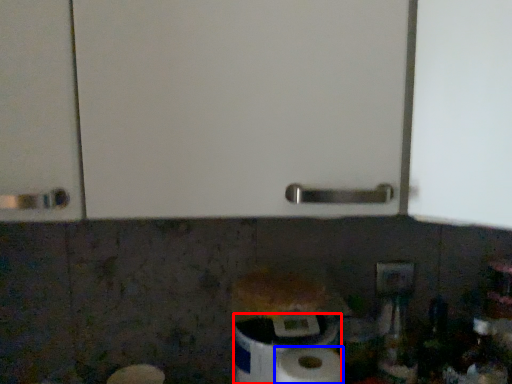
Question: Which point is closer to the camera, toilet paper (highlighted by a red box) or paper towel (highlighted by a blue box)?

Choices:
 (A) toilet paper
 (B) paper towel

Answer: (B)